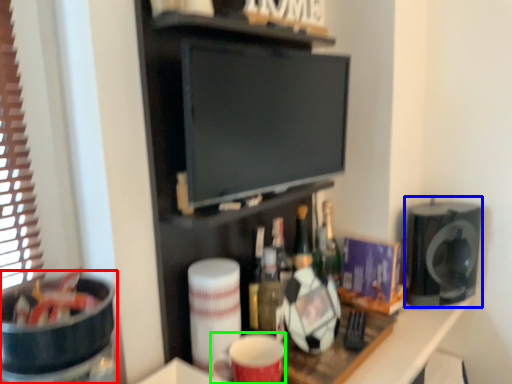
Question: Estimate the real-world distances between objects in this image. Which object is farther from appliance (highlighted by a red box), appliance (highlighted by a blue box) or mug (highlighted by a green box)?

Choices:
 (A) appliance
 (B) mug

Answer: (A)